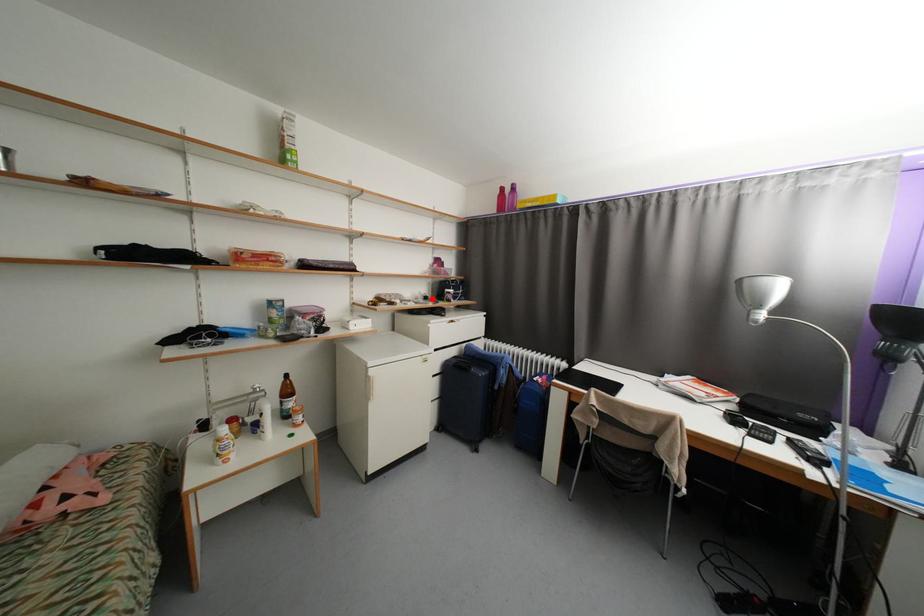
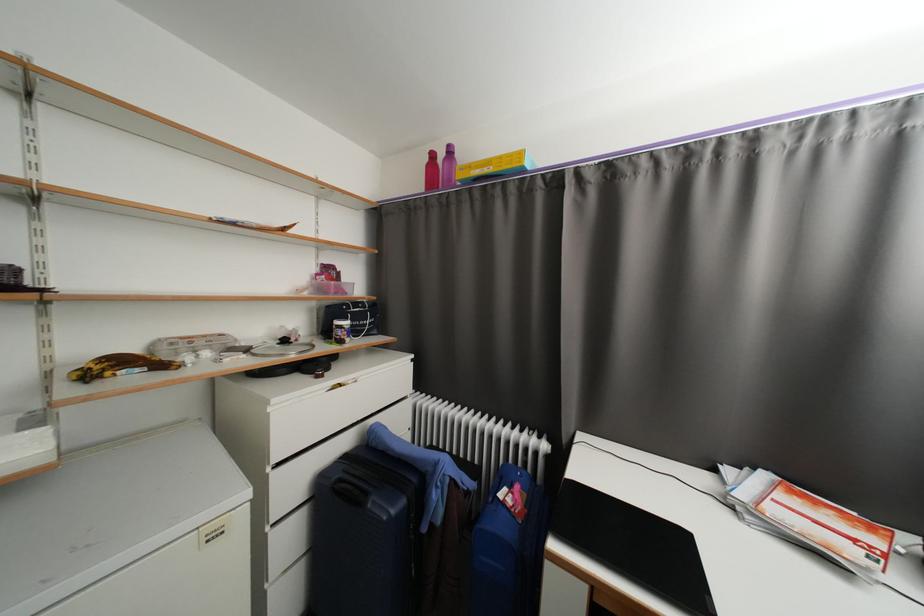
Locate, in the second image, the point that corresponds to the highlighted location in the first image.

(290, 342)